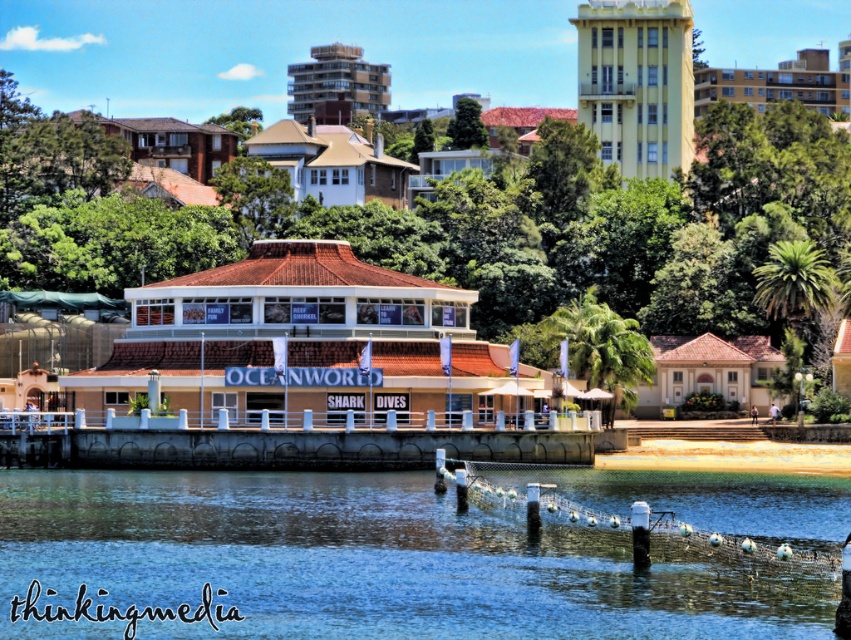
You are standing at the waterfront and want to take a photo of the beige textured building at center without the blue water at lower center appearing in the frame. How should you adjust your position or angle?

Since the blue water at lower center is closer to the viewer than the beige textured building at center, you should move backward or angle your camera upward to avoid capturing the blue water at lower center in the foreground.

You are a tour guide planning a walking route for visitors between the blue water at lower center and the beige textured building at center. The path is straight and unobstructed. If visitors walk at an average speed of 3 feet per second, how many seconds will it take them to reach the building from the water?

The distance between the blue water at lower center and the beige textured building at center is 45.89 feet. At a walking speed of 3 feet per second, it would take approximately 15.3 seconds to reach the building from the water.

You are a visitor standing at the entrance of the marine park and see the blue water at lower center and the beige textured building at center. Which object is positioned more towards the right side of the image?

The blue water at lower center is positioned more towards the right side of the image compared to the beige textured building at center, as it is located to the right of it.